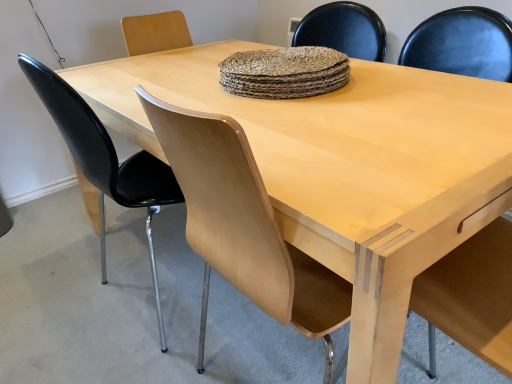
The width and height of the screenshot is (512, 384). Find the location of `vacant space situated on the left part of black glossy chair at left, the 1th chair when ordered from left to right`. vacant space situated on the left part of black glossy chair at left, the 1th chair when ordered from left to right is located at coordinates (61, 294).